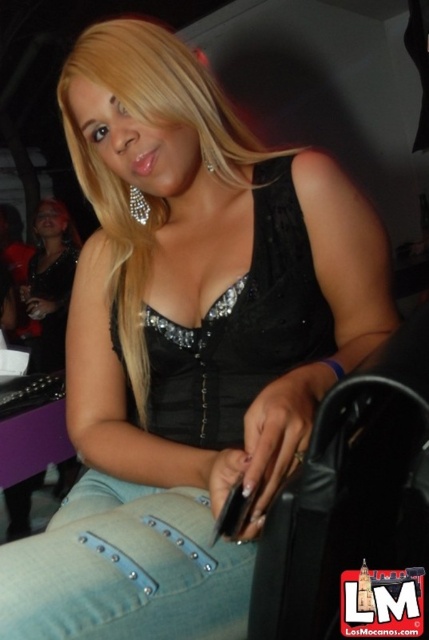
Is point (87, 516) in front of point (72, 243)?

Yes, it is in front of point (72, 243).

Is point (6, 611) positioned behind point (48, 202)?

No, it is not.

What are the coordinates of `jeans at lower left` in the screenshot? It's located at (126, 570).

Image resolution: width=429 pixels, height=640 pixels. I want to click on jeans at lower left, so click(x=126, y=570).